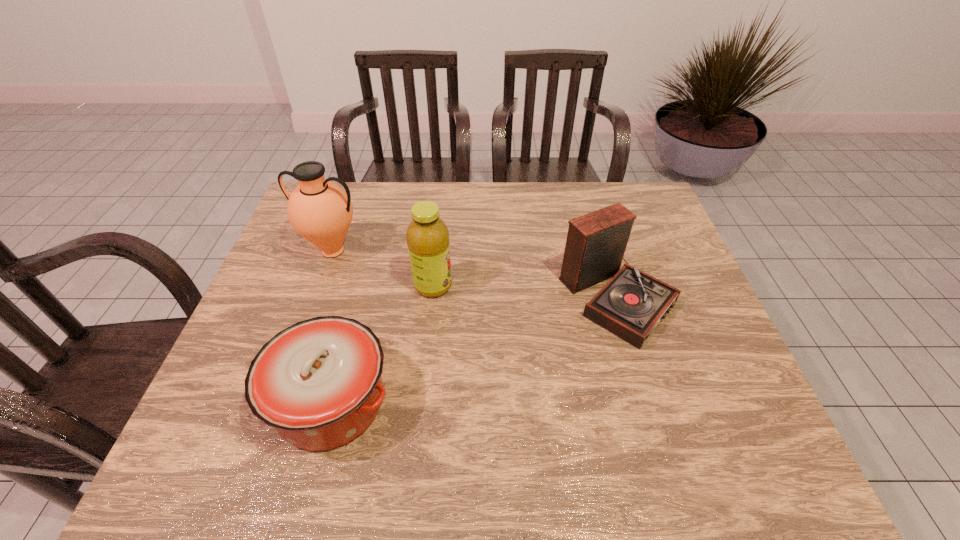
Locate an element on the screen. Image resolution: width=960 pixels, height=540 pixels. object positioned at the near edge is located at coordinates (318, 382).

Where is `pitcher located in the left edge section of the desktop`? The height and width of the screenshot is (540, 960). pitcher located in the left edge section of the desktop is located at coordinates (319, 210).

Find the location of a particular element. The image size is (960, 540). casserole that is positioned at the left edge is located at coordinates (318, 382).

Identify the location of object at the right edge. This screenshot has width=960, height=540. (632, 303).

The width and height of the screenshot is (960, 540). In order to click on object that is at the near left corner in this screenshot , I will do `click(318, 382)`.

In the image, there is a desktop. What are the coordinates of `vacant region at the far edge` in the screenshot? It's located at (441, 188).

At what (x,y) coordinates should I click in order to perform the action: click on vacant space at the near edge. Please return your answer as a coordinate pair (x, y). Looking at the image, I should click on (441, 438).

The image size is (960, 540). Find the location of `vacant region at the left edge of the desktop`. vacant region at the left edge of the desktop is located at coordinates (301, 256).

The height and width of the screenshot is (540, 960). In order to click on vacant space at the right edge of the desktop in this screenshot , I will do `click(634, 265)`.

Image resolution: width=960 pixels, height=540 pixels. In the image, there is a desktop. Identify the location of vacant region at the near left corner. (228, 474).